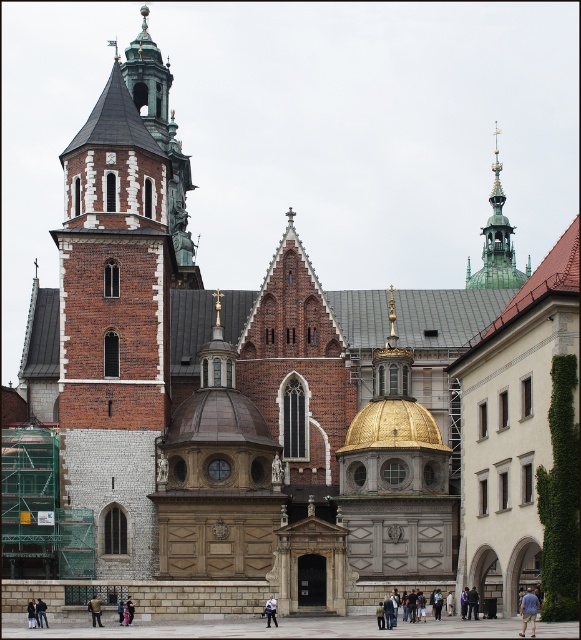
Between light brown leather jacket at lower center and dark gray fabric jacket at lower center, which one has less height?

light brown leather jacket at lower center

Does light brown leather jacket at lower center lie in front of dark gray fabric jacket at lower center?

No, light brown leather jacket at lower center is further to the viewer.

What do you see at coordinates (95, 611) in the screenshot? I see `light brown leather jacket at lower center` at bounding box center [95, 611].

Find the location of a particular element. This screenshot has width=581, height=640. light brown leather jacket at lower center is located at coordinates (95, 611).

Who is lower down, blue cotton shirt at lower right or light brown leather jacket at lower center?

Positioned lower is light brown leather jacket at lower center.

Is the position of blue cotton shirt at lower right less distant than that of light brown leather jacket at lower center?

That is True.

The width and height of the screenshot is (581, 640). What do you see at coordinates (528, 611) in the screenshot? I see `blue cotton shirt at lower right` at bounding box center [528, 611].

Identify the location of blue cotton shirt at lower right. This screenshot has height=640, width=581. (528, 611).

Is point (535, 600) closer to viewer compared to point (34, 618)?

That is True.

Does blue cotton shirt at lower right appear over dark gray fabric jacket at lower center?

Correct, blue cotton shirt at lower right is located above dark gray fabric jacket at lower center.

Describe the element at coordinates (528, 611) in the screenshot. I see `blue cotton shirt at lower right` at that location.

Find the location of a particular element. This screenshot has width=581, height=640. blue cotton shirt at lower right is located at coordinates (528, 611).